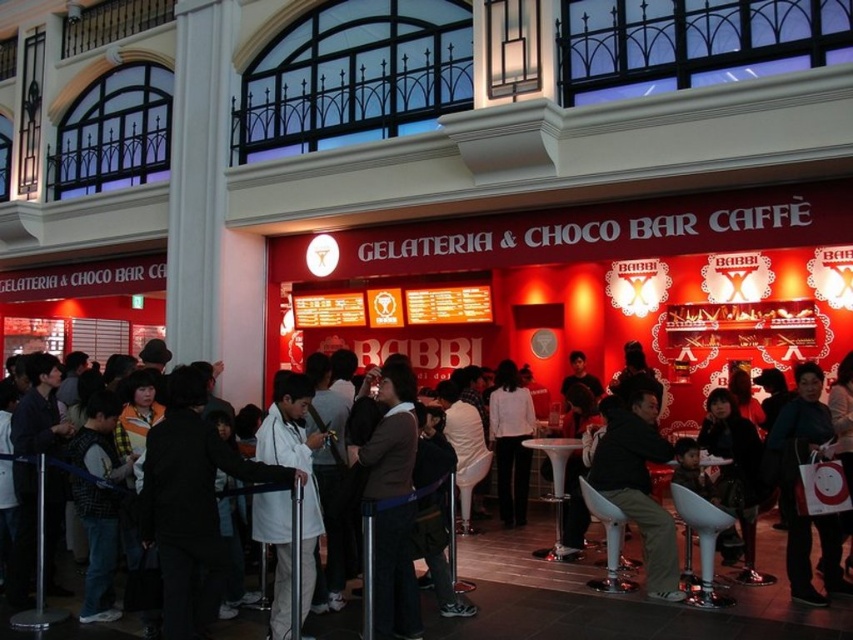
Between point (825, 524) and point (525, 467), which one is positioned behind?

The point (525, 467) is more distant.

Between point (830, 442) and point (503, 512), which one is positioned in front?

Positioned in front is point (830, 442).

Where is `white paper bag at lower right`? white paper bag at lower right is located at coordinates (799, 486).

In the scene shown: Can you confirm if white coat at center is positioned below brown sweater at center?

Yes, white coat at center is below brown sweater at center.

Does white coat at center have a greater height compared to brown sweater at center?

Yes, white coat at center is taller than brown sweater at center.

Which is behind, point (761, 589) or point (386, 534)?

Point (761, 589)

The width and height of the screenshot is (853, 640). What are the coordinates of `white coat at center` in the screenshot? It's located at pyautogui.click(x=606, y=604).

Is the position of white coat at center more distant than that of dark brown leather jacket at center?

No, it is in front of dark brown leather jacket at center.

Is point (709, 621) less distant than point (618, 484)?

Yes, point (709, 621) is in front of point (618, 484).

This screenshot has height=640, width=853. In order to click on white coat at center in this screenshot , I will do `click(606, 604)`.